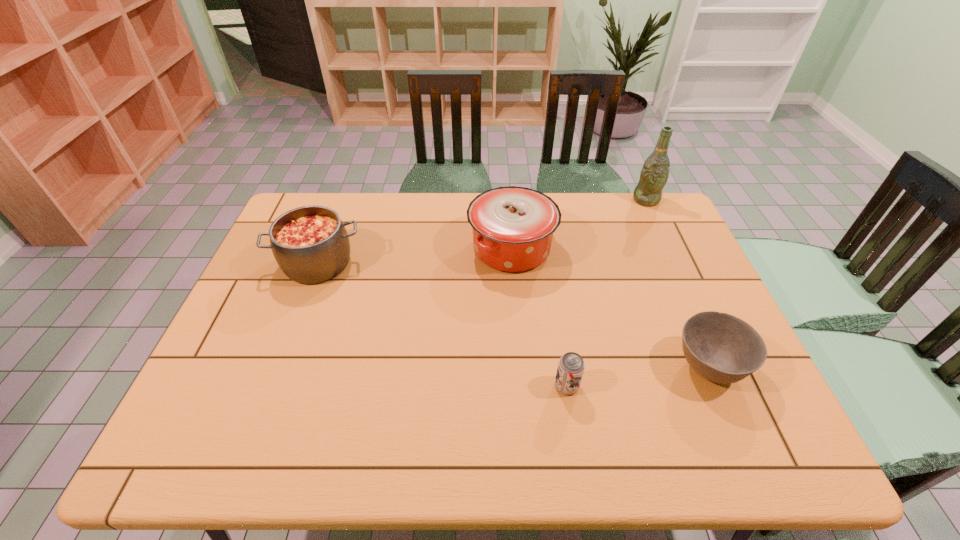
At what (x,y) coordinates should I click in order to perform the action: click on vacant space at the left edge of the desktop. Please return your answer as a coordinate pair (x, y). Image resolution: width=960 pixels, height=540 pixels. Looking at the image, I should click on (216, 393).

Image resolution: width=960 pixels, height=540 pixels. What are the coordinates of `vacant area at the right edge of the desktop` in the screenshot? It's located at (664, 278).

The height and width of the screenshot is (540, 960). In order to click on vacant space at the far left corner in this screenshot , I will do `click(332, 201)`.

You are a GUI agent. You are given a task and a screenshot of the screen. Output one action in this format:
    pyautogui.click(x=<x>, y=<y>)
    Task: Click on the free space at the far right corner of the desktop
    The image size is (960, 540).
    Given the screenshot: What is the action you would take?
    pyautogui.click(x=638, y=214)

Locate an element on the screen. Image resolution: width=960 pixels, height=540 pixels. vacant space at the near right corner is located at coordinates (787, 444).

You are a GUI agent. You are given a task and a screenshot of the screen. Output one action in this format:
    pyautogui.click(x=<x>, y=<y>)
    Task: Click on the unoccupied position between the second tallest object and the beer can
    
    Given the screenshot: What is the action you would take?
    pyautogui.click(x=540, y=317)

This screenshot has width=960, height=540. Identify the location of free point between the leftmost object and the beer can. (443, 325).

In order to click on empty space that is in between the beer bottle and the bowl in this screenshot , I will do `click(677, 283)`.

At what (x,y) coordinates should I click in order to perform the action: click on free space between the bowl and the beer can. Please return your answer as a coordinate pair (x, y). The image size is (960, 540). Looking at the image, I should click on (637, 376).

Find the location of a particular element. free space between the beer can and the third shortest object is located at coordinates (443, 325).